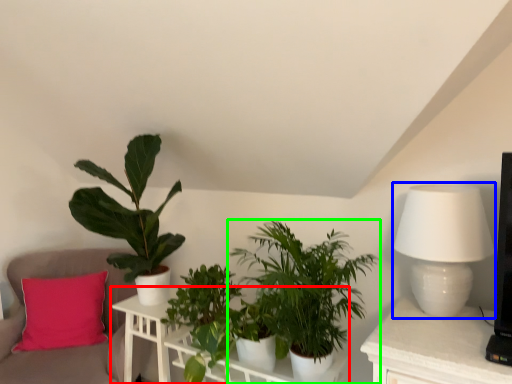
Question: Which object is positioned closest to table (highlighted by a red box)? Select from table lamp (highlighted by a blue box) and houseplant (highlighted by a green box).

Choices:
 (A) table lamp
 (B) houseplant

Answer: (B)